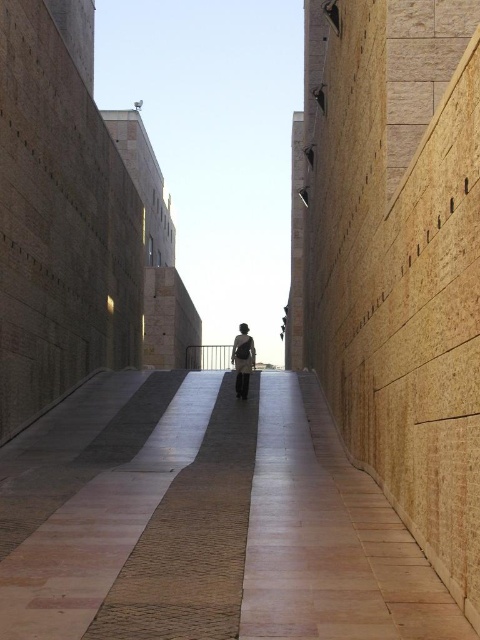
Does polished stone pavement at center have a lesser height compared to white fabric dress at center?

In fact, polished stone pavement at center may be taller than white fabric dress at center.

Can you confirm if polished stone pavement at center is positioned above white fabric dress at center?

No, polished stone pavement at center is not above white fabric dress at center.

This screenshot has height=640, width=480. What do you see at coordinates (204, 520) in the screenshot?
I see `polished stone pavement at center` at bounding box center [204, 520].

This screenshot has height=640, width=480. What are the coordinates of `polished stone pavement at center` in the screenshot? It's located at (204, 520).